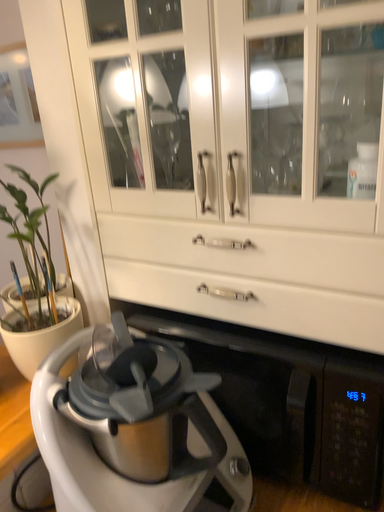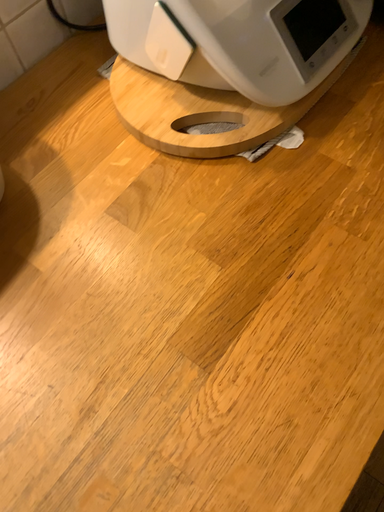
Question: Which way did the camera rotate in the video?

Choices:
 (A) rotated upward
 (B) rotated downward

Answer: (B)